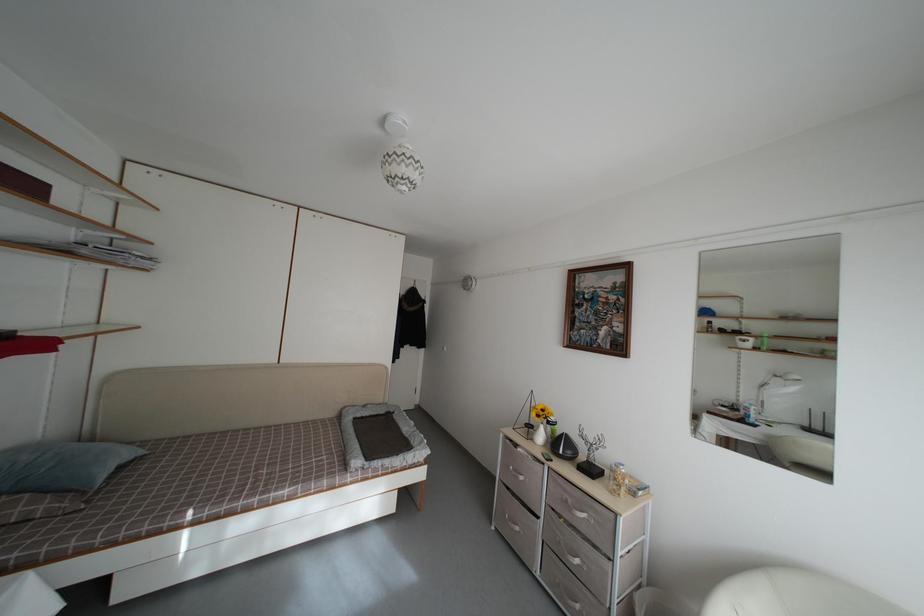
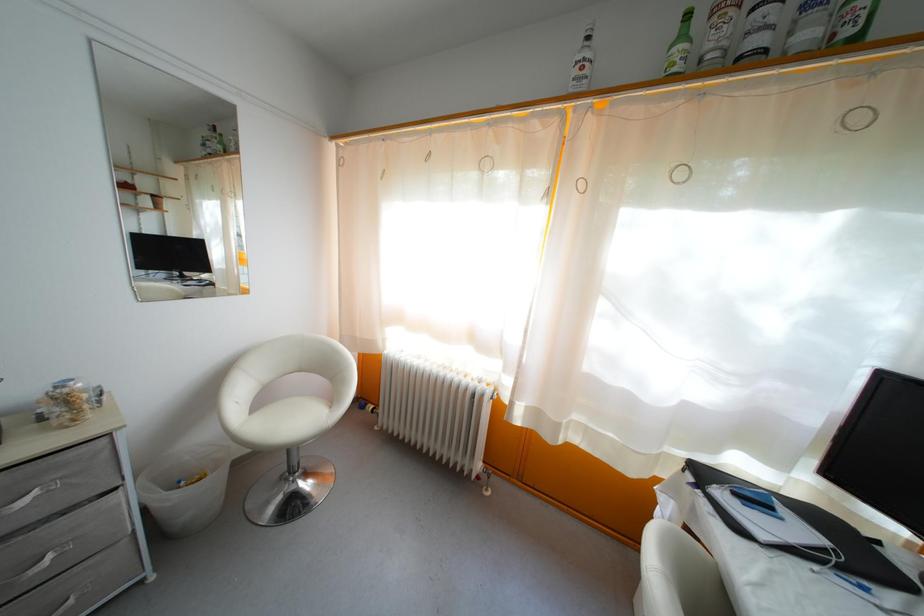
In the second image, find the point that corresponds to point 618,522 in the first image.

(110, 447)